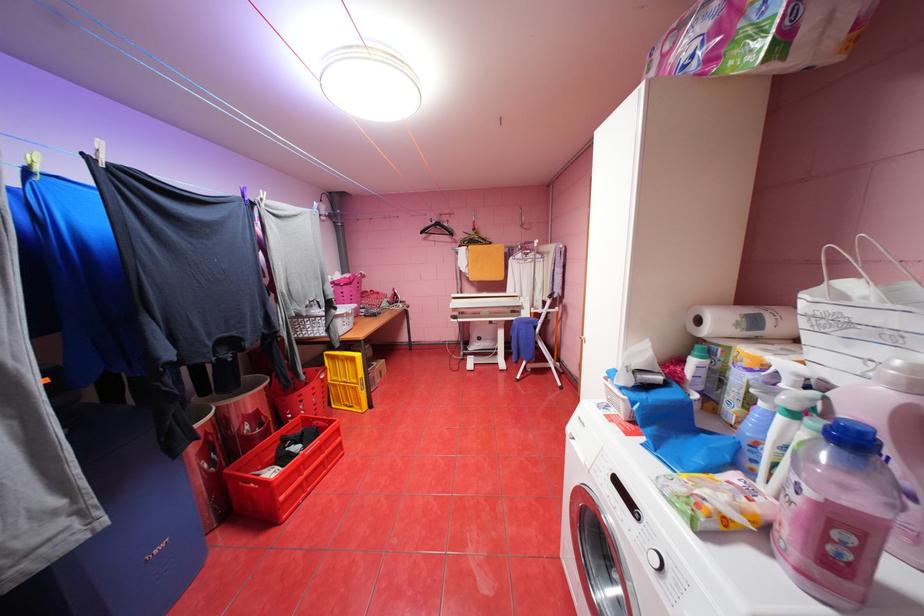
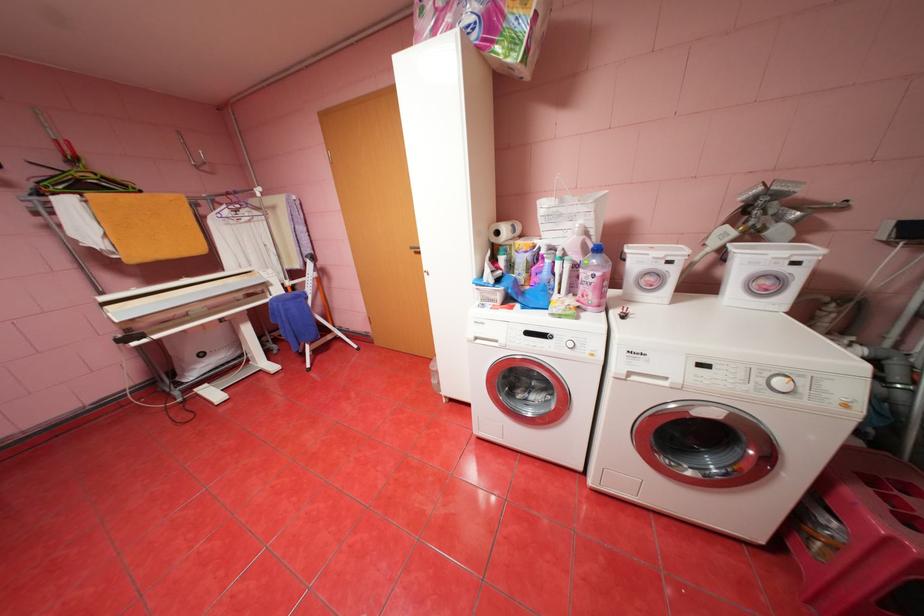
Based on the continuous images, in which direction is the camera rotating?

The camera's rotation is toward right-down.